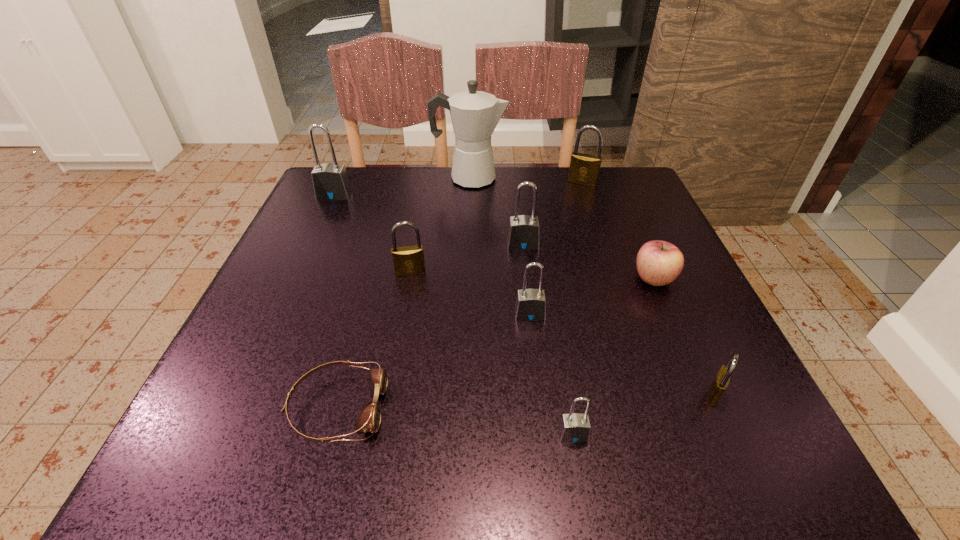
I want to click on vacant area that lies between the smallest brass padlock and the apple, so click(684, 337).

Identify which object is the seventh nearest to the goggles. Please provide its 2D coordinates. Your answer should be formatted as a tuple, i.e. [(x, y)], where the tuple contains the x and y coordinates of a point satisfying the conditions above.

[(330, 181)]

You are a GUI agent. You are given a task and a screenshot of the screen. Output one action in this format:
    pyautogui.click(x=<x>, y=<y>)
    Task: Click on the second closest object to the apple
    Image resolution: width=960 pixels, height=540 pixels.
    Given the screenshot: What is the action you would take?
    click(530, 305)

Identify the location of padlock identified as the fifth closest to the seventh nearest object. This screenshot has width=960, height=540. (574, 427).

Point out which padlock is positioned as the third nearest to the nearest gray padlock. Please provide its 2D coordinates. Your answer should be formatted as a tuple, i.e. [(x, y)], where the tuple contains the x and y coordinates of a point satisfying the conditions above.

[(409, 260)]

The width and height of the screenshot is (960, 540). In order to click on gray padlock that is the second closest one to the apple in this screenshot , I will do `click(530, 305)`.

Identify the location of the closest gray padlock relative to the tallest padlock. Image resolution: width=960 pixels, height=540 pixels. (523, 234).

Choose which brass padlock is the nearest neighbor to the sixth farthest padlock. Please provide its 2D coordinates. Your answer should be formatted as a tuple, i.e. [(x, y)], where the tuple contains the x and y coordinates of a point satisfying the conditions above.

[(409, 260)]

The height and width of the screenshot is (540, 960). What are the coordinates of `the second closest brass padlock to the nearest brass padlock` in the screenshot? It's located at (584, 169).

Image resolution: width=960 pixels, height=540 pixels. In order to click on vacant space that satisfies the following two spatial constraints: 1. on the front side of the apple; 2. on the left side of the second smallest brass padlock in this screenshot , I will do point(409,279).